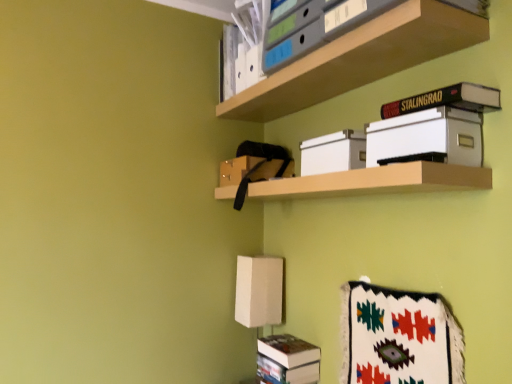
Question: Is white cardboard box at center facing away from wooden shelf at center, which ranks as the 2th shelf in top-to-bottom order?

Choices:
 (A) no
 (B) yes

Answer: (A)

Question: From the image's perspective, is white cardboard box at center located above wooden shelf at center, the 1th shelf from the bottom?

Choices:
 (A) yes
 (B) no

Answer: (A)

Question: Is wooden shelf at center, the 1th shelf from the bottom, surrounded by white cardboard box at center?

Choices:
 (A) no
 (B) yes

Answer: (A)

Question: Is white cardboard box at center next to wooden shelf at center, which ranks as the 2th shelf in top-to-bottom order?

Choices:
 (A) yes
 (B) no

Answer: (B)

Question: Is white cardboard box at center facing towards wooden shelf at center, the 1th shelf from the bottom?

Choices:
 (A) no
 (B) yes

Answer: (A)

Question: Can you confirm if white cardboard box at center is positioned to the left of wooden shelf at center, the 1th shelf from the bottom?

Choices:
 (A) yes
 (B) no

Answer: (B)

Question: Is the depth of wooden shelf at center, which ranks as the 2th shelf in top-to-bottom order, greater than that of hardcover black book at upper right?

Choices:
 (A) yes
 (B) no

Answer: (B)

Question: Does wooden shelf at center, which ranks as the 2th shelf in top-to-bottom order, have a smaller size compared to hardcover black book at upper right?

Choices:
 (A) yes
 (B) no

Answer: (B)

Question: From the image's perspective, is wooden shelf at center, which ranks as the 2th shelf in top-to-bottom order, on top of hardcover black book at upper right?

Choices:
 (A) yes
 (B) no

Answer: (B)

Question: Is the surface of wooden shelf at center, which ranks as the 2th shelf in top-to-bottom order, in direct contact with hardcover black book at upper right?

Choices:
 (A) yes
 (B) no

Answer: (B)

Question: Can you confirm if wooden shelf at center, which ranks as the 2th shelf in top-to-bottom order, is shorter than hardcover black book at upper right?

Choices:
 (A) no
 (B) yes

Answer: (A)

Question: Could you tell me if wooden shelf at center, the 1th shelf from the bottom, is turned towards hardcover black book at upper right?

Choices:
 (A) no
 (B) yes

Answer: (A)

Question: Does hardcover black book at upper right turn towards wooden shelf at center, the 1th shelf from the bottom?

Choices:
 (A) yes
 (B) no

Answer: (B)